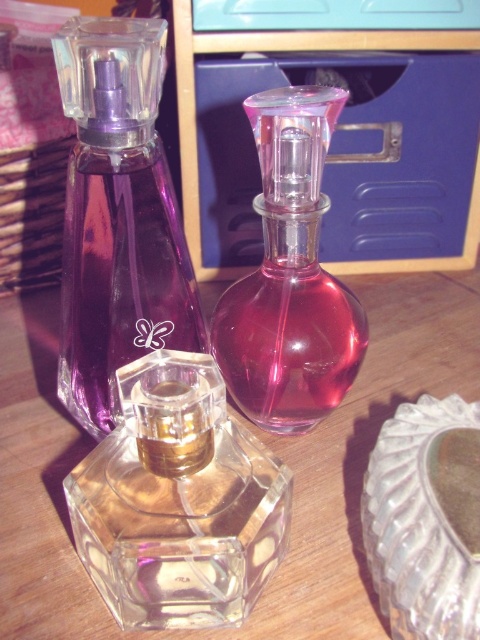
Question: Which point is closer to the camera?

Choices:
 (A) transparent glass perfume bottle at center
 (B) pink glass perfume at center
 (C) purple glass perfume at center

Answer: (C)

Question: Which point appears farthest from the camera in this image?

Choices:
 (A) (176, 468)
 (B) (478, 486)
 (C) (352, 324)
 (D) (132, 90)

Answer: (C)

Question: Where is transparent glass perfume bottle at center located in relation to transparent glass perfume at center in the image?

Choices:
 (A) right
 (B) left

Answer: (A)

Question: Which of the following is the farthest from the observer?

Choices:
 (A) transparent glass perfume bottle at center
 (B) purple glass perfume at center
 (C) transparent glass perfume at center
 (D) clear textured glass at center

Answer: (A)

Question: Does purple glass perfume at center have a lesser width compared to clear textured glass at center?

Choices:
 (A) yes
 (B) no

Answer: (B)

Question: Can you confirm if transparent glass perfume bottle at center is bigger than purple glass perfume at center?

Choices:
 (A) yes
 (B) no

Answer: (A)